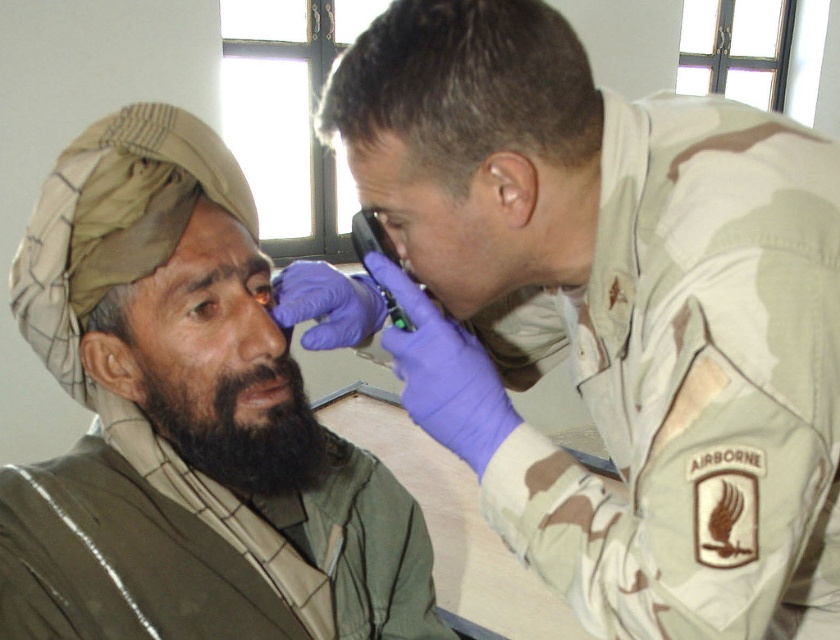
Question: Observing the image, what is the correct spatial positioning of brown matte forehead at upper left in reference to brown matte nose at center?

Choices:
 (A) right
 (B) left

Answer: (B)

Question: Estimate the real-world distances between objects in this image. Which object is farther from the brown matte forehead at upper left?

Choices:
 (A) bearded man at left
 (B) green fabric shirt at left

Answer: (B)

Question: Which of the following is the closest to the observer?

Choices:
 (A) (4, 499)
 (B) (413, 93)
 (C) (180, 422)

Answer: (B)

Question: Which is farther from the brown matte forehead at upper left?

Choices:
 (A) brown matte nose at center
 (B) green fabric shirt at left
 (C) camo uniform at upper right
 (D) bearded man at left

Answer: (C)

Question: Can you confirm if green fabric shirt at left is smaller than black fuzzy beard at lower left?

Choices:
 (A) no
 (B) yes

Answer: (A)

Question: Does bearded man at left appear under black fuzzy beard at lower left?

Choices:
 (A) yes
 (B) no

Answer: (A)